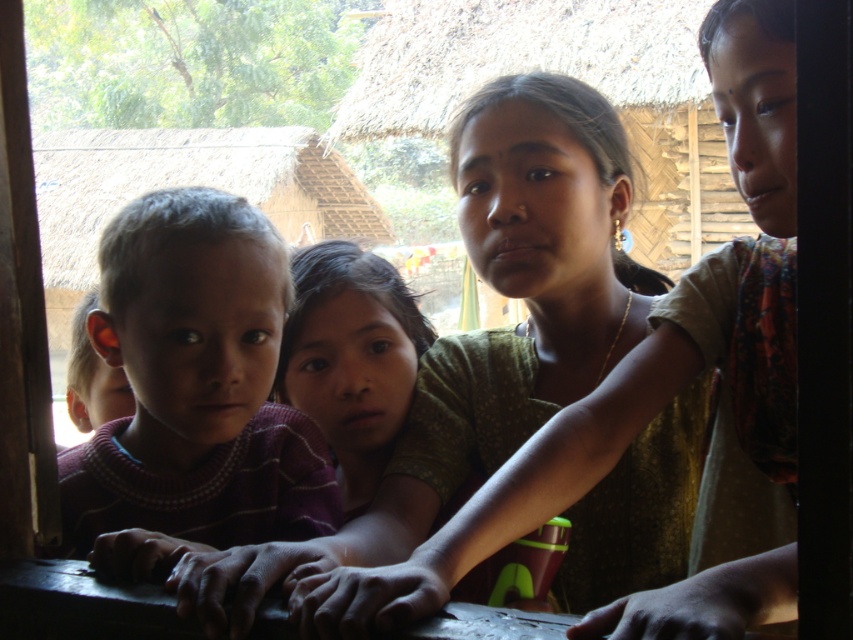
You are a tailor measuring clothing for the children in the scene. The striped knit sweater at left and the matte green shirt at center need alterations. Which garment has a greater width that requires more fabric for adjustments?

The striped knit sweater at left has a greater width than the matte green shirt at center, so it requires more fabric for adjustments.

Based on the photo, you are an interior designer working on a virtual 3D model of this scene. You need to place a decorative sticker exactly where the striped knit sweater at left is located. What are the coordinates for placing the sticker?

The coordinates for placing the decorative sticker where the striped knit sweater at left is located are at point (192, 392).